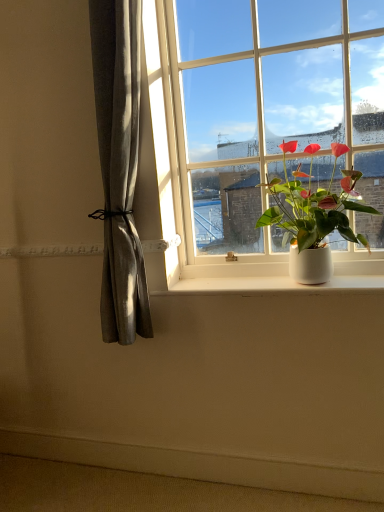
Question: Does white smooth ledge at lower center turn towards white smooth window sill at lower center?

Choices:
 (A) no
 (B) yes

Answer: (A)

Question: From a real-world perspective, is white smooth ledge at lower center over white smooth window sill at lower center?

Choices:
 (A) yes
 (B) no

Answer: (B)

Question: Is white smooth ledge at lower center to the left of white smooth window sill at lower center from the viewer's perspective?

Choices:
 (A) yes
 (B) no

Answer: (A)

Question: Does white smooth ledge at lower center have a greater height compared to white smooth window sill at lower center?

Choices:
 (A) no
 (B) yes

Answer: (B)

Question: Is white smooth window sill at lower center at the back of white smooth ledge at lower center?

Choices:
 (A) no
 (B) yes

Answer: (A)

Question: Can you confirm if white smooth ledge at lower center is wider than white smooth window sill at lower center?

Choices:
 (A) no
 (B) yes

Answer: (A)

Question: From the image's perspective, is white smooth ledge at lower center below white glossy window at upper center?

Choices:
 (A) no
 (B) yes

Answer: (B)

Question: Is white smooth ledge at lower center bigger than white glossy window at upper center?

Choices:
 (A) yes
 (B) no

Answer: (B)

Question: Is the depth of white smooth ledge at lower center greater than that of white glossy window at upper center?

Choices:
 (A) yes
 (B) no

Answer: (A)

Question: Considering the relative sizes of white smooth ledge at lower center and white glossy window at upper center in the image provided, is white smooth ledge at lower center taller than white glossy window at upper center?

Choices:
 (A) no
 (B) yes

Answer: (A)

Question: From the image's perspective, is white smooth ledge at lower center above white glossy window at upper center?

Choices:
 (A) yes
 (B) no

Answer: (B)

Question: Considering the relative sizes of white smooth ledge at lower center and white glossy window at upper center in the image provided, is white smooth ledge at lower center thinner than white glossy window at upper center?

Choices:
 (A) no
 (B) yes

Answer: (B)

Question: Is white glossy window at upper center at the left side of green matte plant at right?

Choices:
 (A) no
 (B) yes

Answer: (B)